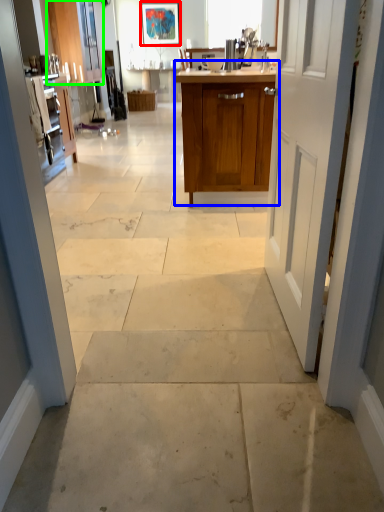
Question: Which object is the farthest from picture frame (highlighted by a red box)? Choose among these: cabinetry (highlighted by a blue box) or cabinetry (highlighted by a green box).

Choices:
 (A) cabinetry
 (B) cabinetry

Answer: (A)